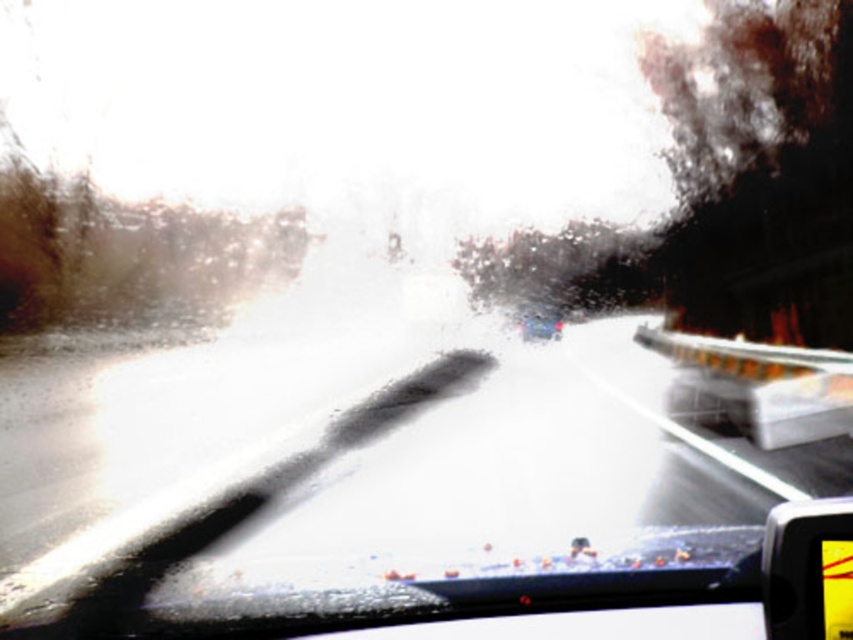
Question: Is yellow plastic view mirror at lower right below metallic silver car at center?

Choices:
 (A) yes
 (B) no

Answer: (A)

Question: Is yellow plastic view mirror at lower right further to camera compared to metallic silver car at center?

Choices:
 (A) yes
 (B) no

Answer: (B)

Question: Which of the following is the farthest from the observer?

Choices:
 (A) (550, 314)
 (B) (770, 566)

Answer: (A)

Question: Can you confirm if yellow plastic view mirror at lower right is smaller than metallic silver car at center?

Choices:
 (A) no
 (B) yes

Answer: (B)